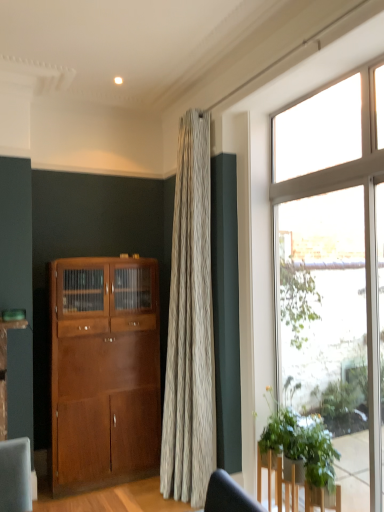
Question: Is clear glass window at right to the right of shiny brown cabinet at left from the viewer's perspective?

Choices:
 (A) no
 (B) yes

Answer: (B)

Question: Is clear glass window at right not inside shiny brown cabinet at left?

Choices:
 (A) no
 (B) yes

Answer: (B)

Question: From the image's perspective, is clear glass window at right above shiny brown cabinet at left?

Choices:
 (A) yes
 (B) no

Answer: (A)

Question: Considering the relative sizes of clear glass window at right and shiny brown cabinet at left in the image provided, is clear glass window at right shorter than shiny brown cabinet at left?

Choices:
 (A) yes
 (B) no

Answer: (B)

Question: Is clear glass window at right in front of shiny brown cabinet at left?

Choices:
 (A) yes
 (B) no

Answer: (A)

Question: From the image's perspective, relative to green leafy plant at lower right, is clear glass window at right above or below?

Choices:
 (A) above
 (B) below

Answer: (A)

Question: Considering the positions of clear glass window at right and green leafy plant at lower right in the image, is clear glass window at right bigger or smaller than green leafy plant at lower right?

Choices:
 (A) small
 (B) big

Answer: (B)

Question: In terms of height, does clear glass window at right look taller or shorter compared to green leafy plant at lower right?

Choices:
 (A) short
 (B) tall

Answer: (B)

Question: Do you think clear glass window at right is within green leafy plant at lower right, or outside of it?

Choices:
 (A) outside
 (B) inside

Answer: (A)

Question: Is green leafy plant at lower right wider or thinner than shiny brown cabinet at left?

Choices:
 (A) thin
 (B) wide

Answer: (A)

Question: Do you think green leafy plant at lower right is within shiny brown cabinet at left, or outside of it?

Choices:
 (A) outside
 (B) inside

Answer: (A)

Question: Relative to shiny brown cabinet at left, is green leafy plant at lower right in front or behind?

Choices:
 (A) front
 (B) behind

Answer: (A)

Question: From a real-world perspective, is green leafy plant at lower right above or below shiny brown cabinet at left?

Choices:
 (A) above
 (B) below

Answer: (B)

Question: Is clear glass window at right in front of or behind shiny brown cabinet at left in the image?

Choices:
 (A) front
 (B) behind

Answer: (A)

Question: From the image's perspective, is clear glass window at right positioned above or below shiny brown cabinet at left?

Choices:
 (A) below
 (B) above

Answer: (B)